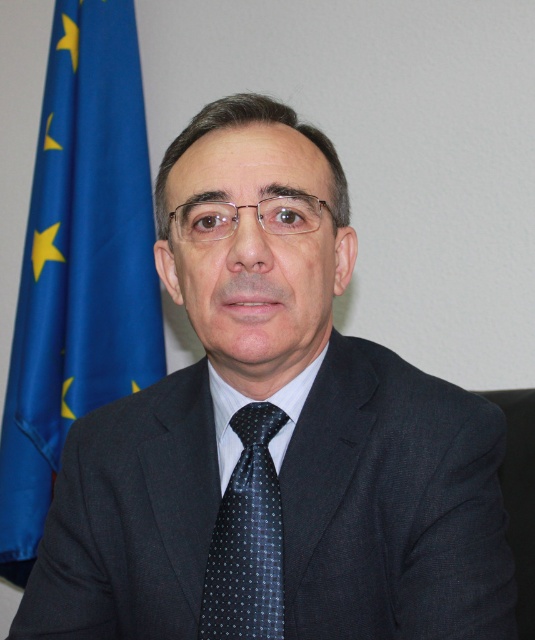
You are an interior designer asked to hang a new flag in an office. The current flag is the blue fabric flag at left, and the tie is the dark blue dotted tie at center. Since the flag is larger than the tie, which object would require a stronger support structure to hang properly?

The blue fabric flag at left requires a stronger support structure because it has a larger size compared to the dark blue dotted tie at center, making it heavier and needing more secure hanging.

You are an assistant who needs to locate the dark blue dotted tie at center in the image. The coordinates given are point (247, 538). Can you confirm if this point is correctly placed on the dark blue dotted tie at center?

Yes, the point (247, 538) is correctly placed on the dark blue dotted tie at center as stated in the description.